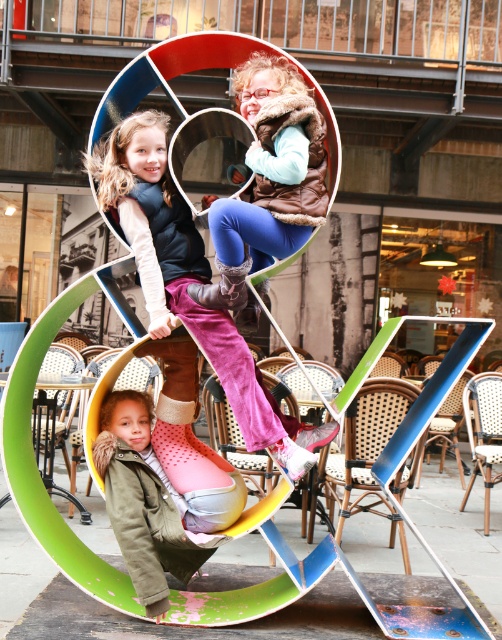
Question: Where is velvet pink pants at center located in relation to velvet blue pants at center in the image?

Choices:
 (A) right
 (B) left

Answer: (B)

Question: Which object is closer to the camera taking this photo?

Choices:
 (A) velvet pink pants at center
 (B) velvet blue pants at center

Answer: (B)

Question: Among these points, which one is farthest from the camera?

Choices:
 (A) (248, 246)
 (B) (143, 124)

Answer: (B)

Question: Is velvet pink pants at center thinner than velvet blue pants at center?

Choices:
 (A) yes
 (B) no

Answer: (B)

Question: Is velvet pink pants at center to the left of velvet blue pants at center from the viewer's perspective?

Choices:
 (A) yes
 (B) no

Answer: (A)

Question: Which of the following is the farthest from the observer?

Choices:
 (A) (302, 211)
 (B) (185, 301)

Answer: (B)